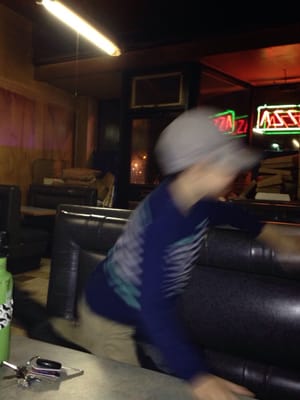
I want to click on floor, so click(40, 296).